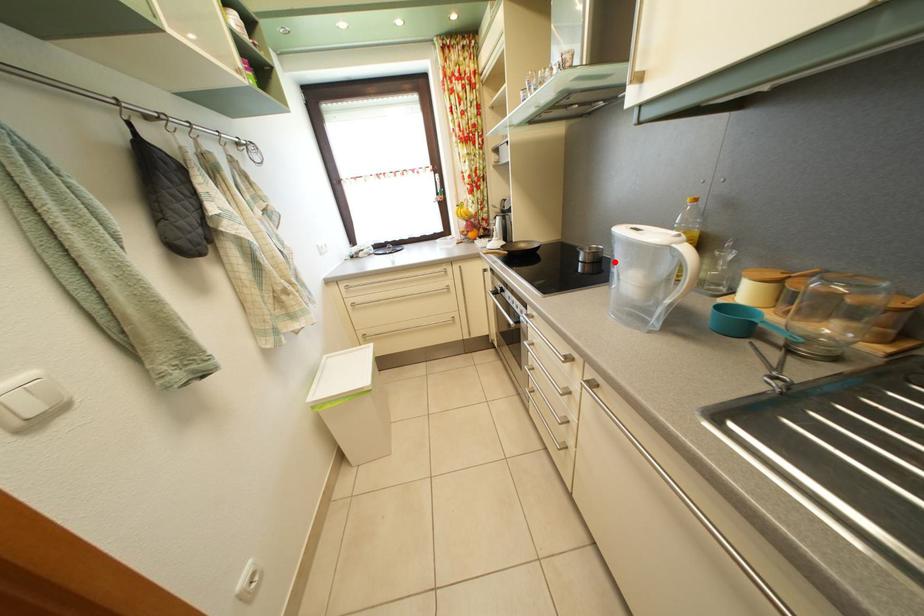
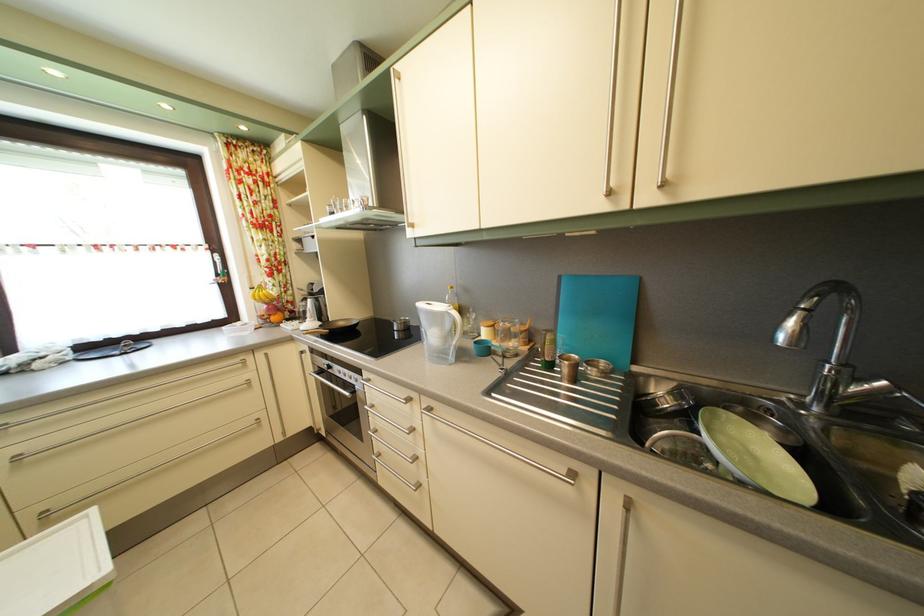
Find the pixel in the second image that matches the highlighted location in the first image.

(420, 331)